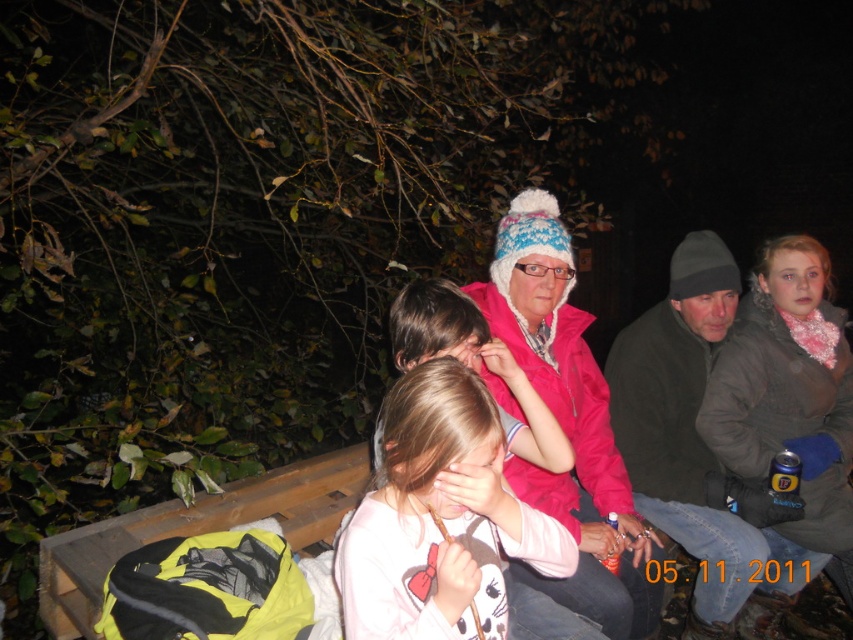
Who is taller, pink fleece jacket at center or dark gray knit hat at right?

Standing taller between the two is dark gray knit hat at right.

Does pink fleece jacket at center lie behind dark gray knit hat at right?

No.

Which is in front, point (589, 496) or point (692, 372)?

Point (589, 496)

The height and width of the screenshot is (640, 853). I want to click on pink fleece jacket at center, so click(x=567, y=422).

Which of these two, pink fleece jacket at center or brown fuzzy jacket at upper right, stands shorter?

Standing shorter between the two is pink fleece jacket at center.

Who is more forward, (538, 209) or (776, 294)?

Point (538, 209) is in front.

Locate an element on the screen. pink fleece jacket at center is located at coordinates (567, 422).

Locate an element on the screen. pink fleece jacket at center is located at coordinates (567, 422).

In the scene shown: Is dark gray knit hat at right bigger than brown fuzzy jacket at upper right?

No, dark gray knit hat at right is not bigger than brown fuzzy jacket at upper right.

Is dark gray knit hat at right smaller than brown fuzzy jacket at upper right?

Yes, dark gray knit hat at right is smaller than brown fuzzy jacket at upper right.

Is point (767, 552) closer to viewer compared to point (749, 404)?

Yes, point (767, 552) is closer to viewer.

Where is `dark gray knit hat at right`? The height and width of the screenshot is (640, 853). dark gray knit hat at right is located at coordinates (686, 428).